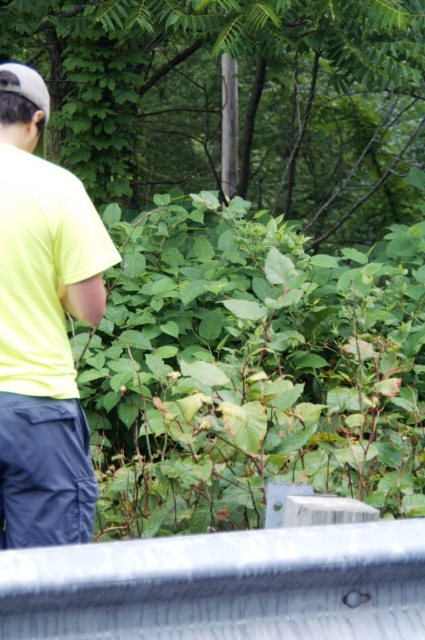
You are standing in the outdoor scene with dense greenery. You notice two points marked in the image. The first point is at coordinates point (x=96, y=634) and the second is at point (x=22, y=93). Which point is nearer to you?

Point (x=96, y=634) is closer to the viewer than point (x=22, y=93).

You are standing at the point labeled as point (223, 586) in the image. What object are you standing on?

The point (223, 586) indicates the metallic gray rail at lower center, so you are standing on the metallic gray rail at lower center.